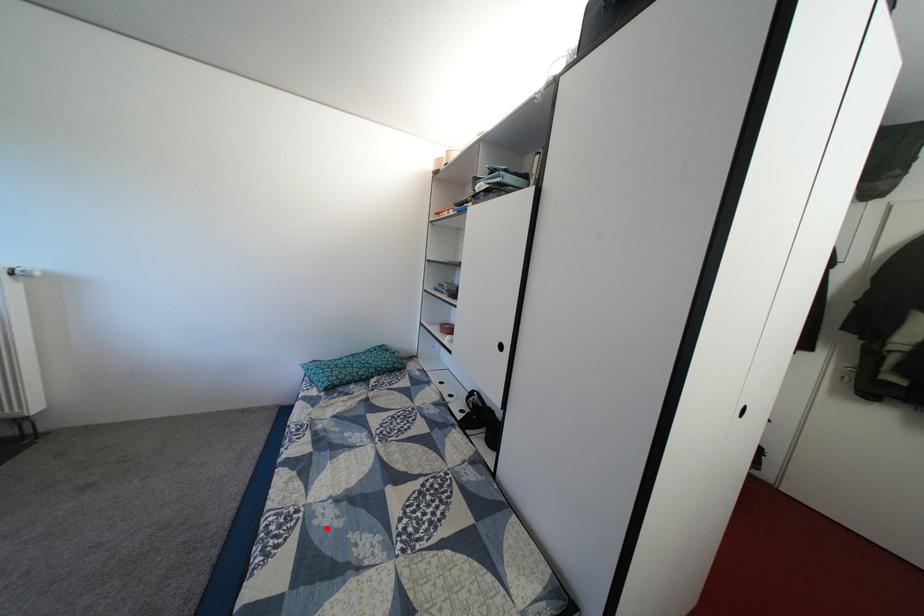
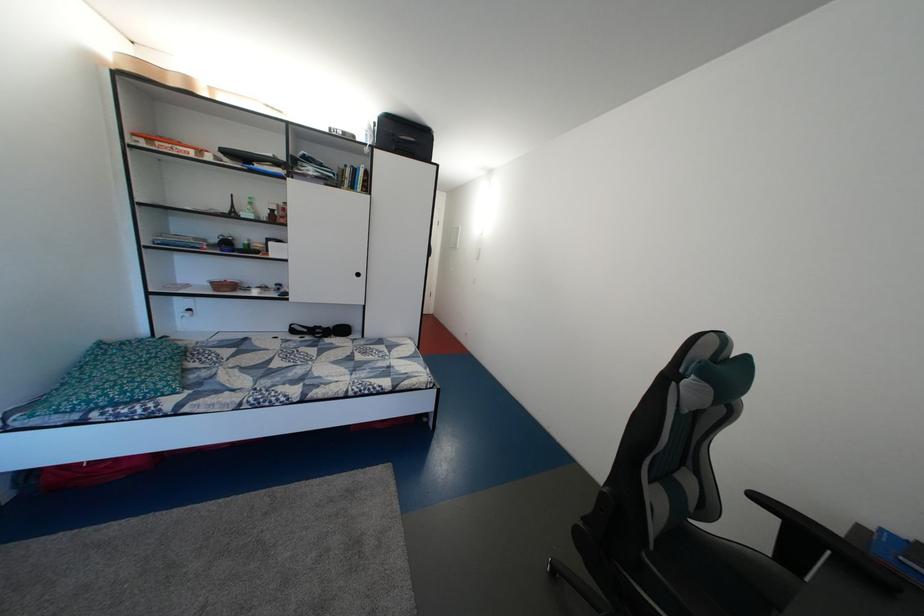
The point at the highlighted location is marked in the first image. Where is the corresponding point in the second image?

(373, 382)